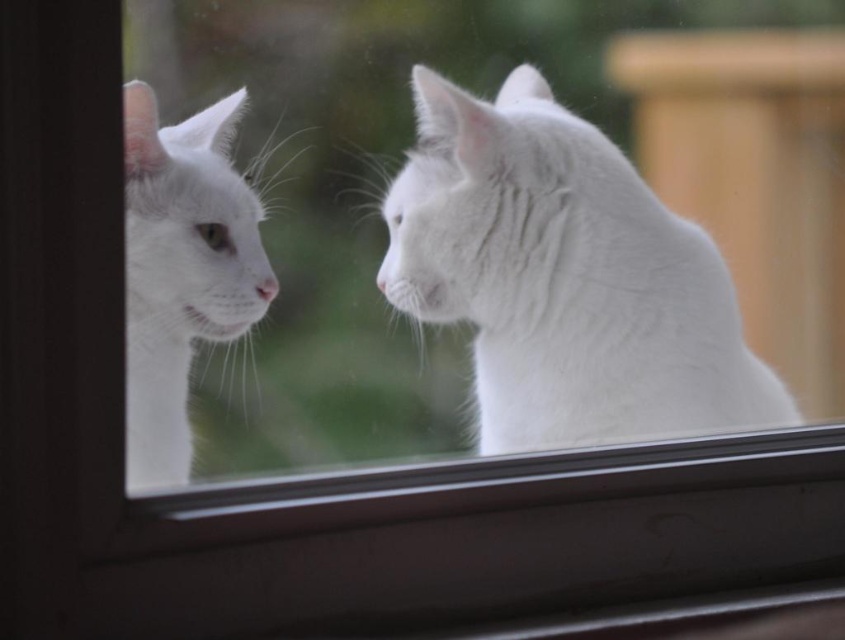
You are standing in front of the window where the two white cats are looking at each other. You want to take a photo of the cats through the window. The camera you are holding has a focus range of 3 feet to infinity. Will the point at point [634,193] be in focus?

The point at point [634,193] is 3.75 feet from the camera, which is within the focus range of 3 feet to infinity. Therefore, the point will be in focus.

You are taking a photo of the two cats through the window. The camera is positioned at the same level as the window. Which point, point (x=538, y=113) or point (x=184, y=316), is closer to the camera?

Point (x=184, y=316) is closer to the camera than point (x=538, y=113) because the description states that point (x=538, y=113) is further away from the camera compared to point (x=184, y=316).

You are a cat owner who wants to place a new cat bed between the white fluffy cat at center and the white fluffy cat at left. The cat bed is 1.2 meters wide. Can the cat bed fit between them?

The white fluffy cat at center might be wider than the white fluffy cat at left, but the description does not provide exact measurements of their widths. Without knowing the exact distance between them, it is uncertain if the cat bed will fit.